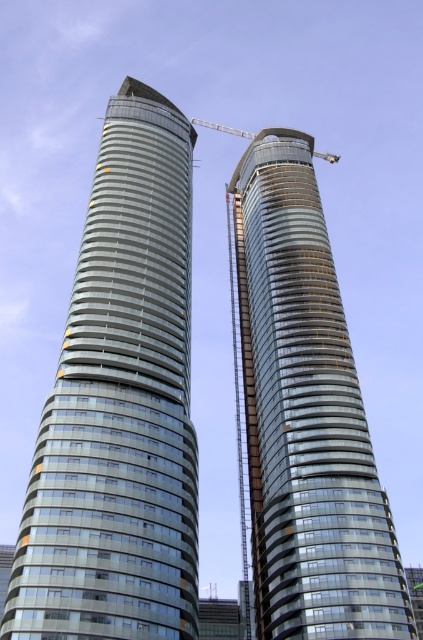
You are a construction worker standing at the base of the glassy metallic skyscraper at left. You need to measure the distance between your current position and the crane located between the two towers. Can you estimate how far you are from the crane?

The distance of glassy metallic skyscraper at left from camera is 41.71 meters. Since the crane is positioned between the two towers, and you are at the base of the left skyscraper, the distance to the crane would depend on the spacing between the towers. Without specific information on the separation between the two buildings, an exact measurement cannot be provided.